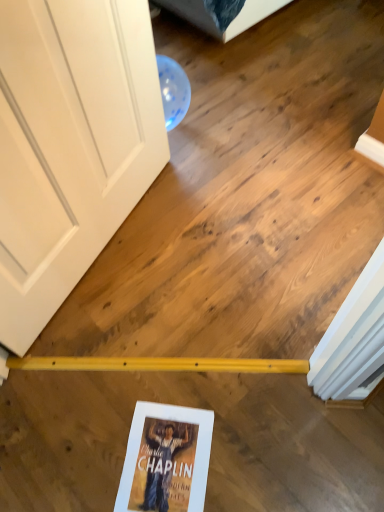
The width and height of the screenshot is (384, 512). In order to click on vacant region under white matte door at upper left (from a real-world perspective) in this screenshot , I will do `click(106, 249)`.